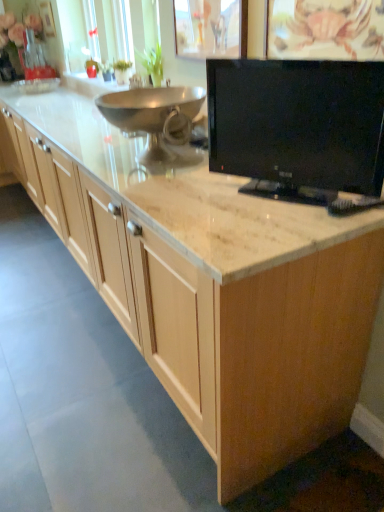
Consider the image. In order to face black glossy tv at upper right, should I rotate leftwards or rightwards?

Rotate your view right by about 12.505°.

I want to click on polished stainless steel bowl at center, so click(x=156, y=121).

This screenshot has height=512, width=384. I want to click on black glossy tv at upper right, so [298, 122].

Is polished stainless steel bowl at center positioned in front of satin nickel faucet at upper center?

Yes, polished stainless steel bowl at center is in front of satin nickel faucet at upper center.

Is there a large distance between polished stainless steel bowl at center and satin nickel faucet at upper center?

That's not correct — polished stainless steel bowl at center is a little close to satin nickel faucet at upper center.

Image resolution: width=384 pixels, height=512 pixels. In order to click on appliance below the satin nickel faucet at upper center (from a real-world perspective) in this screenshot , I will do `click(156, 121)`.

From a real-world perspective, is black glossy tv at upper right physically located above or below polished stainless steel bowl at center?

Clearly, from a real-world perspective, black glossy tv at upper right is above polished stainless steel bowl at center.

Which of these two, black glossy tv at upper right or polished stainless steel bowl at center, is bigger?

With larger size is polished stainless steel bowl at center.

At what (x,y) coordinates should I click in order to perform the action: click on appliance that appears behind the black glossy tv at upper right. Please return your answer as a coordinate pair (x, y). The height and width of the screenshot is (512, 384). Looking at the image, I should click on (156, 121).

Is black glossy tv at upper right to the left of polished stainless steel bowl at center from the viewer's perspective?

No.

Does satin nickel faucet at upper center lie in front of polished stainless steel bowl at center?

No, satin nickel faucet at upper center is further to the viewer.

Which of these two, satin nickel faucet at upper center or polished stainless steel bowl at center, stands taller?

With more height is polished stainless steel bowl at center.

Does satin nickel faucet at upper center contain polished stainless steel bowl at center?

That's incorrect, polished stainless steel bowl at center is not inside satin nickel faucet at upper center.

From the image's perspective, is polished stainless steel bowl at center on black glossy tv at upper right?

Yes, from the image's perspective, polished stainless steel bowl at center is above black glossy tv at upper right.

Is polished stainless steel bowl at center next to black glossy tv at upper right?

They are not placed beside each other.

From a real-world perspective, who is located lower, polished stainless steel bowl at center or black glossy tv at upper right?

polished stainless steel bowl at center, from a real-world perspective.

Consider the image. Measure the distance from polished stainless steel bowl at center to black glossy tv at upper right.

16.40 inches.

How different are the orientations of satin nickel faucet at upper center and black glossy tv at upper right in degrees?

The angular difference between satin nickel faucet at upper center and black glossy tv at upper right is 29.7 degrees.

Looking at the image, does satin nickel faucet at upper center seem bigger or smaller compared to black glossy tv at upper right?

Considering their sizes, satin nickel faucet at upper center takes up less space than black glossy tv at upper right.

In terms of width, does satin nickel faucet at upper center look wider or thinner when compared to black glossy tv at upper right?

Clearly, satin nickel faucet at upper center has less width compared to black glossy tv at upper right.

Can you confirm if satin nickel faucet at upper center is shorter than black glossy tv at upper right?

Correct, satin nickel faucet at upper center is not as tall as black glossy tv at upper right.

At what (x,y) coordinates should I click in order to perform the action: click on faucet below the black glossy tv at upper right (from a real-world perspective). Please return your answer as a coordinate pair (x, y). This screenshot has height=512, width=384. Looking at the image, I should click on (136, 81).

Which point is more distant from viewer, (356,135) or (140,77)?

The point (140,77) is behind.

From the image's perspective, is black glossy tv at upper right located beneath satin nickel faucet at upper center?

Indeed, from the image's perspective, black glossy tv at upper right is shown beneath satin nickel faucet at upper center.

You are a GUI agent. You are given a task and a screenshot of the screen. Output one action in this format:
    pyautogui.click(x=<x>, y=<y>)
    Task: Click on the appliance that is in front of the satin nickel faucet at upper center
    The width and height of the screenshot is (384, 512).
    Given the screenshot: What is the action you would take?
    pyautogui.click(x=156, y=121)

Identify the location of appliance on the left of black glossy tv at upper right. (156, 121).

Based on their spatial positions, is polished stainless steel bowl at center or black glossy tv at upper right further from satin nickel faucet at upper center?

The object further to satin nickel faucet at upper center is black glossy tv at upper right.

Looking at this image, when comparing their distances from black glossy tv at upper right, does satin nickel faucet at upper center or polished stainless steel bowl at center seem further?

Based on the image, satin nickel faucet at upper center appears to be further to black glossy tv at upper right.

Considering their positions, is polished stainless steel bowl at center positioned further to black glossy tv at upper right than satin nickel faucet at upper center?

Based on the image, satin nickel faucet at upper center appears to be further to black glossy tv at upper right.

Based on their spatial positions, is satin nickel faucet at upper center or black glossy tv at upper right further from polished stainless steel bowl at center?

Based on the image, satin nickel faucet at upper center appears to be further to polished stainless steel bowl at center.

Looking at this image, based on their spatial positions, is black glossy tv at upper right or satin nickel faucet at upper center further from polished stainless steel bowl at center?

satin nickel faucet at upper center lies further to polished stainless steel bowl at center than the other object.

Based on their spatial positions, is black glossy tv at upper right or polished stainless steel bowl at center further from satin nickel faucet at upper center?

black glossy tv at upper right lies further to satin nickel faucet at upper center than the other object.

Identify the location of appliance between black glossy tv at upper right and satin nickel faucet at upper center in the front-back direction. (156, 121).